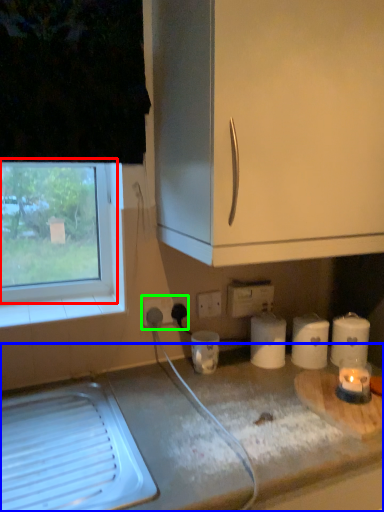
Question: Which is farther away from window (highlighted by a red box)? countertop (highlighted by a blue box) or electric outlet (highlighted by a green box)?

Choices:
 (A) countertop
 (B) electric outlet

Answer: (A)